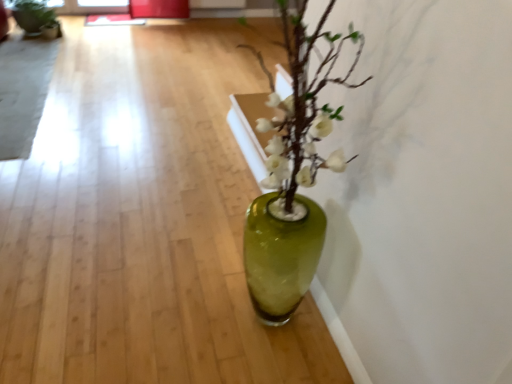
Image resolution: width=512 pixels, height=384 pixels. What are the coordinates of `translucent glass vase at center` in the screenshot? It's located at coord(298,142).

What is the approximate height of matte black pot at upper left?

The height of matte black pot at upper left is 13.76 inches.

Locate an element on the screen. The width and height of the screenshot is (512, 384). translucent glass vase at center is located at coordinates (298, 142).

Between translucent glass vase at center and matte black pot at upper left, which one has more height?

Standing taller between the two is matte black pot at upper left.

Can you tell me how much translucent glass vase at center and matte black pot at upper left differ in facing direction?

There is a 86.1-degree angle between the facing directions of translucent glass vase at center and matte black pot at upper left.

Between translucent glass vase at center and matte black pot at upper left, which one appears on the right side from the viewer's perspective?

From the viewer's perspective, translucent glass vase at center appears more on the right side.

Between translucent glass vase at center and matte black pot at upper left, which one has larger width?

Wider between the two is matte black pot at upper left.

Image resolution: width=512 pixels, height=384 pixels. I want to click on flower above the green glass vase at center (from the image's perspective), so click(298, 142).

From the image's perspective, is green glass vase at center located above translucent glass vase at center?

No.

In the scene shown: Could translucent glass vase at center be considered to be inside green glass vase at center?

No, translucent glass vase at center is not surrounded by green glass vase at center.

Could you tell me if green glass vase at center is turned towards translucent glass vase at center?

Yes, green glass vase at center faces towards translucent glass vase at center.

Is matte black pot at upper left taller or shorter than translucent glass vase at center?

In the image, matte black pot at upper left appears to be taller than translucent glass vase at center.

Considering the sizes of matte black pot at upper left and translucent glass vase at center in the image, is matte black pot at upper left bigger or smaller than translucent glass vase at center?

Considering their sizes, matte black pot at upper left takes up less space than translucent glass vase at center.

Can you tell me how much matte black pot at upper left and translucent glass vase at center differ in facing direction?

86.1 degrees separate the facing orientations of matte black pot at upper left and translucent glass vase at center.

Does matte black pot at upper left turn towards translucent glass vase at center?

No, matte black pot at upper left is not facing towards translucent glass vase at center.

Is point (280, 122) closer or farther from the camera than point (289, 111)?

Point (280, 122).

From the image's perspective, between translucent glass vase at center and green glass vase at center, which one is located above?

From the image's view, translucent glass vase at center is above.

Is the surface of translucent glass vase at center in direct contact with green glass vase at center?

No, translucent glass vase at center is not in contact with green glass vase at center.

Are matte black pot at upper left and green glass vase at center located far from each other?

That's right, there is a large distance between matte black pot at upper left and green glass vase at center.

In terms of size, does matte black pot at upper left appear bigger or smaller than green glass vase at center?

In the image, matte black pot at upper left appears to be larger than green glass vase at center.

Which object is further away from the camera, matte black pot at upper left or green glass vase at center?

matte black pot at upper left is behind.

Does matte black pot at upper left appear on the left side of green glass vase at center?

Yes.

How much distance is there between green glass vase at center and matte black pot at upper left?

They are 3.23 meters apart.

Choose the correct answer: Is green glass vase at center inside matte black pot at upper left or outside it?

The correct answer is: outside.

In order to click on houseplant lying on the right of matte black pot at upper left in this screenshot , I will do `click(293, 175)`.

What's the angular difference between green glass vase at center and matte black pot at upper left's facing directions?

86.1 degrees separate the facing orientations of green glass vase at center and matte black pot at upper left.

Locate an element on the screen. Image resolution: width=512 pixels, height=384 pixels. flowerpot above the translucent glass vase at center (from the image's perspective) is located at coordinates (36, 20).

What are the coordinates of `flower located behind the green glass vase at center` in the screenshot? It's located at [298, 142].

When comparing their distances from green glass vase at center, does translucent glass vase at center or matte black pot at upper left seem closer?

Based on the image, translucent glass vase at center appears to be nearer to green glass vase at center.

When comparing their distances from translucent glass vase at center, does green glass vase at center or matte black pot at upper left seem closer?

green glass vase at center.

Estimate the real-world distances between objects in this image. Which object is closer to matte black pot at upper left, green glass vase at center or translucent glass vase at center?

green glass vase at center is closer to matte black pot at upper left.

Considering their positions, is matte black pot at upper left positioned further to green glass vase at center than translucent glass vase at center?

matte black pot at upper left is positioned further to the anchor green glass vase at center.

When comparing their distances from translucent glass vase at center, does matte black pot at upper left or green glass vase at center seem closer?

green glass vase at center.

Estimate the real-world distances between objects in this image. Which object is further from matte black pot at upper left, translucent glass vase at center or green glass vase at center?

The object further to matte black pot at upper left is translucent glass vase at center.

You are a GUI agent. You are given a task and a screenshot of the screen. Output one action in this format:
    pyautogui.click(x=<x>, y=<y>)
    Task: Click on the houseplant between matte black pot at upper left and translucent glass vase at center in the horizontal direction
    This screenshot has width=512, height=384.
    Given the screenshot: What is the action you would take?
    pyautogui.click(x=293, y=175)